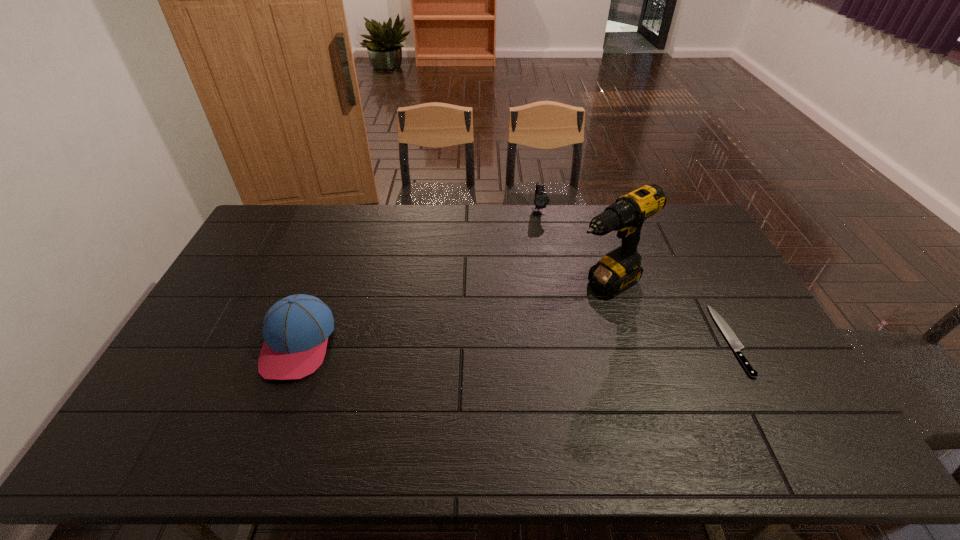
You are a GUI agent. You are given a task and a screenshot of the screen. Output one action in this format:
    pyautogui.click(x=<x>, y=<y>)
    Task: Click on the leftmost object
    
    Given the screenshot: What is the action you would take?
    pyautogui.click(x=296, y=328)

Locate an element on the screen. the shortest object is located at coordinates (731, 337).

Where is `the rightmost object`? Image resolution: width=960 pixels, height=540 pixels. the rightmost object is located at coordinates (731, 337).

Where is `the farthest object`? The width and height of the screenshot is (960, 540). the farthest object is located at coordinates [541, 199].

Where is `watch`? watch is located at coordinates (541, 199).

I want to click on the tallest object, so click(x=618, y=270).

Identify the location of drill. The image size is (960, 540). (618, 270).

What are the coordinates of `vacant area situated on the front-facing side of the baseball cap` in the screenshot? It's located at (273, 411).

Identify the location of vacant space located 0.050m on the right of the steak knife. This screenshot has height=540, width=960. (756, 340).

You are a GUI agent. You are given a task and a screenshot of the screen. Output one action in this format:
    pyautogui.click(x=<x>, y=<y>)
    Task: Click on the blank area located 0.210m on the face of the third object from right to left
    Image resolution: width=960 pixels, height=540 pixels.
    Given the screenshot: What is the action you would take?
    pyautogui.click(x=546, y=254)